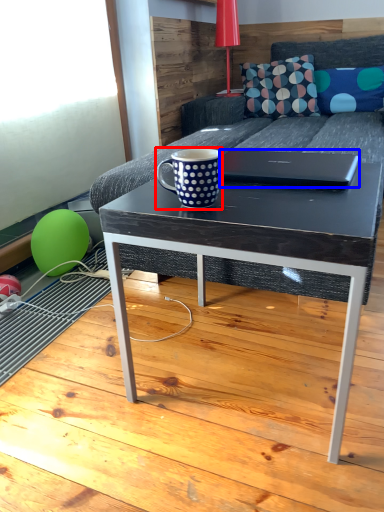
Question: Which of the following is the farthest to the observer, coffee cup (highlighted by a red box) or laptop (highlighted by a blue box)?

Choices:
 (A) coffee cup
 (B) laptop

Answer: (B)